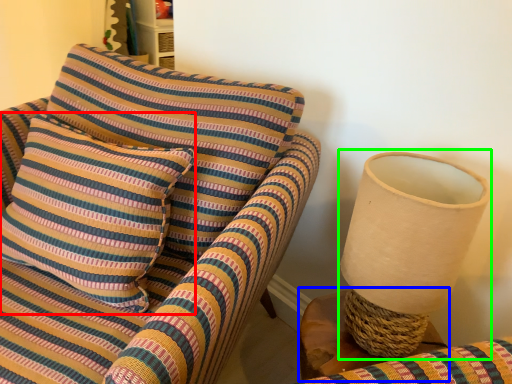
Question: Which object is the farthest from pillow (highlighted by a red box)? Choose among these: table (highlighted by a blue box) or table lamp (highlighted by a green box).

Choices:
 (A) table
 (B) table lamp

Answer: (B)